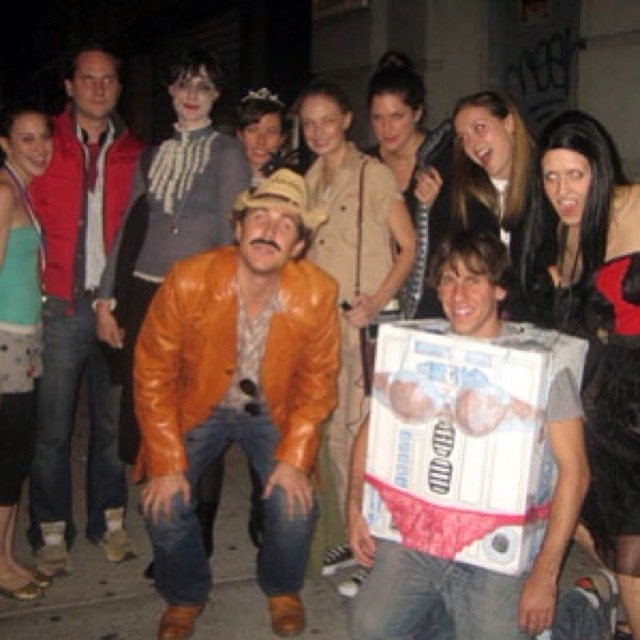
You are taking a photo of the scene and want to focus on the two points labeled as point (x=6, y=490) and point (x=628, y=467). Which point should you adjust your camera focus to first to ensure both are in sharp focus?

You should focus on point (x=6, y=490) first because it is closer to the camera than point (x=628, y=467). By focusing on the closer point, the farther point will also be in focus due to the depth of field.

You are a photographer trying to focus on two points in the image. The first point is at coordinate point (81, 68) and the second point is at coordinate point (604, 376). Which point is closer to your camera lens?

Point (81, 68) is closer to the camera lens than point (604, 376) because it is further to the camera.

You are a photographer trying to capture a group photo of the matte red vest at left and the black leather dress at upper right. The camera you are using has a maximum focus range of 8 feet. Can you fit both subjects into the frame without moving closer?

The matte red vest at left and black leather dress at upper right are 8.49 feet apart, which exceeds the camera maximum focus range of 8 feet. Therefore, you cannot fit both subjects into the frame without moving closer.